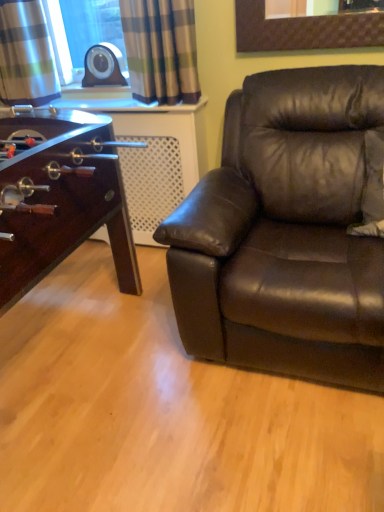
Question: From the image's perspective, is plaid fabric curtain at upper left, positioned as the second curtain in left-to-right order, positioned above or below plaid fabric curtain at upper left, which is counted as the 1th curtain, starting from the left?

Choices:
 (A) above
 (B) below

Answer: (B)

Question: From their relative heights in the image, would you say plaid fabric curtain at upper left, positioned as the second curtain in left-to-right order, is taller or shorter than plaid fabric curtain at upper left, the 2th curtain from the right?

Choices:
 (A) tall
 (B) short

Answer: (B)

Question: Estimate the real-world distances between objects in this image. Which object is closer to the plaid fabric curtain at upper left, positioned as the second curtain in left-to-right order?

Choices:
 (A) brown leather couch at right
 (B) plaid fabric curtain at upper left, which is counted as the 1th curtain, starting from the left

Answer: (B)

Question: Considering the real-world distances, which object is closest to the plaid fabric curtain at upper left, positioned as the second curtain in left-to-right order?

Choices:
 (A) brown leather couch at right
 (B) plaid fabric curtain at upper left, the 2th curtain from the right

Answer: (B)